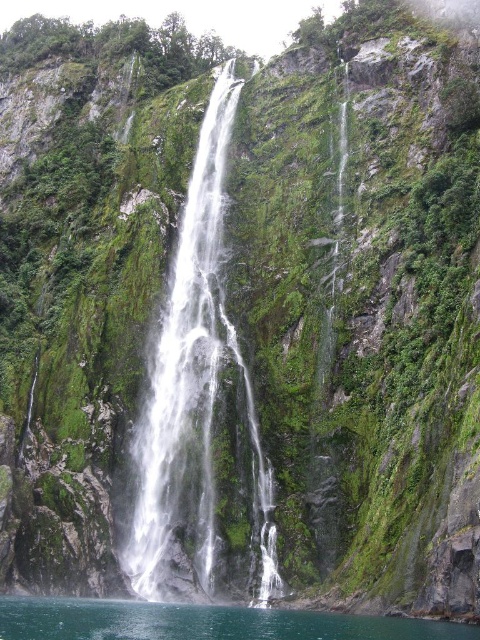
Is white glossy waterfall at center below clear water at lower center?

No, white glossy waterfall at center is not below clear water at lower center.

Does white glossy waterfall at center appear on the left side of clear water at lower center?

In fact, white glossy waterfall at center is to the right of clear water at lower center.

The image size is (480, 640). I want to click on white glossy waterfall at center, so click(193, 394).

Find the location of a particular element. The height and width of the screenshot is (640, 480). white glossy waterfall at center is located at coordinates (193, 394).